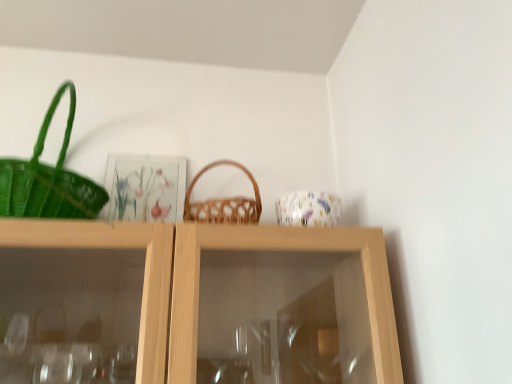
Question: Considering the positions of floral-patterned ceramic cup at upper center and woven brown picnic basket at center in the image, is floral-patterned ceramic cup at upper center taller or shorter than woven brown picnic basket at center?

Choices:
 (A) short
 (B) tall

Answer: (A)

Question: From a real-world perspective, relative to woven brown picnic basket at center, is floral-patterned ceramic cup at upper center vertically above or below?

Choices:
 (A) above
 (B) below

Answer: (B)

Question: From the image's perspective, relative to woven brown picnic basket at center, is floral-patterned ceramic cup at upper center above or below?

Choices:
 (A) above
 (B) below

Answer: (B)

Question: Based on their positions, is woven brown picnic basket at center located to the left or right of floral-patterned ceramic cup at upper center?

Choices:
 (A) left
 (B) right

Answer: (A)

Question: Do you think woven brown picnic basket at center is within floral-patterned ceramic cup at upper center, or outside of it?

Choices:
 (A) inside
 (B) outside

Answer: (B)

Question: From the image's perspective, relative to floral-patterned ceramic cup at upper center, is woven brown picnic basket at center above or below?

Choices:
 (A) below
 (B) above

Answer: (B)

Question: In terms of size, does woven brown picnic basket at center appear bigger or smaller than floral-patterned ceramic cup at upper center?

Choices:
 (A) big
 (B) small

Answer: (A)